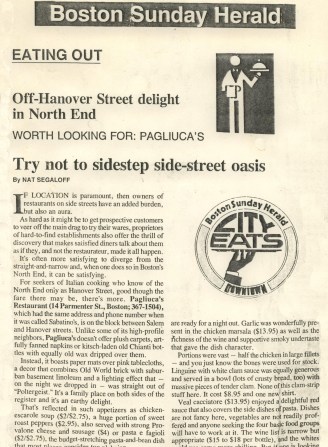
At what (x,y) coordinates should I click in order to perform the action: click on news paper. Please return your answer as a coordinate pair (x, y). Image resolution: width=328 pixels, height=447 pixels. Looking at the image, I should click on (184, 300).